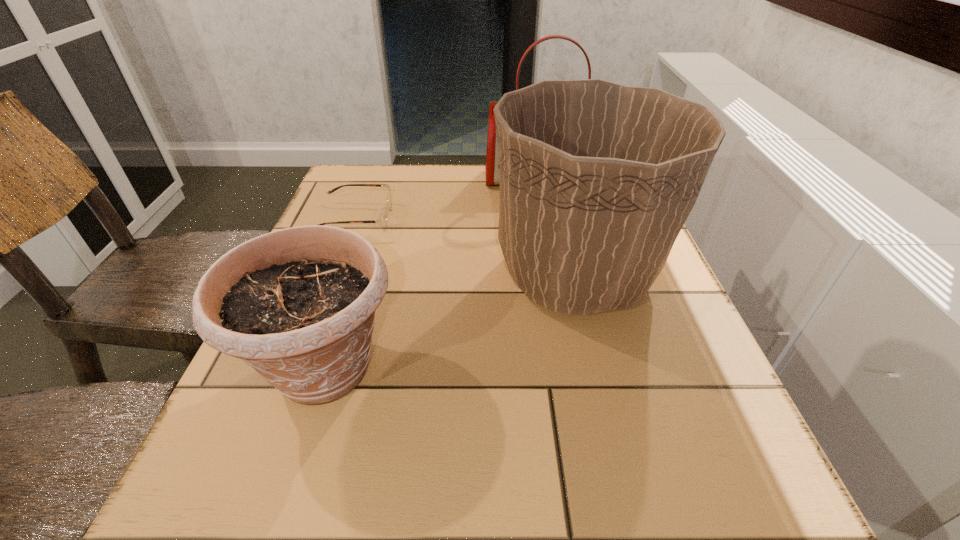
Where is `vacant space that satisfies the following two spatial constraints: 1. on the back side of the shorter flowerpot; 2. on the front-facing side of the shortest object`? The width and height of the screenshot is (960, 540). vacant space that satisfies the following two spatial constraints: 1. on the back side of the shorter flowerpot; 2. on the front-facing side of the shortest object is located at coordinates (372, 219).

Image resolution: width=960 pixels, height=540 pixels. Find the location of `free location that satisfies the following two spatial constraints: 1. on the front-facing side of the spectacles; 2. on the right side of the shorter flowerpot`. free location that satisfies the following two spatial constraints: 1. on the front-facing side of the spectacles; 2. on the right side of the shorter flowerpot is located at coordinates (300, 368).